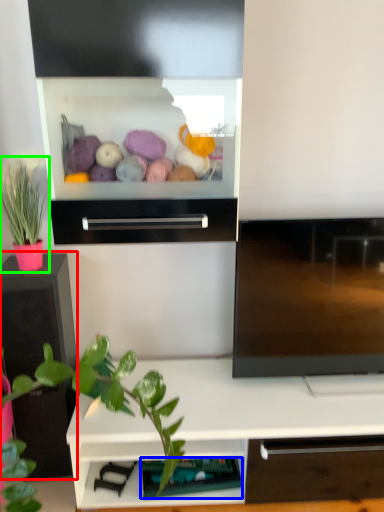
Question: Which object is the farthest from tv cabinet (highlighted by a red box)? Choose among these: shelf (highlighted by a blue box) or houseplant (highlighted by a green box).

Choices:
 (A) shelf
 (B) houseplant

Answer: (A)